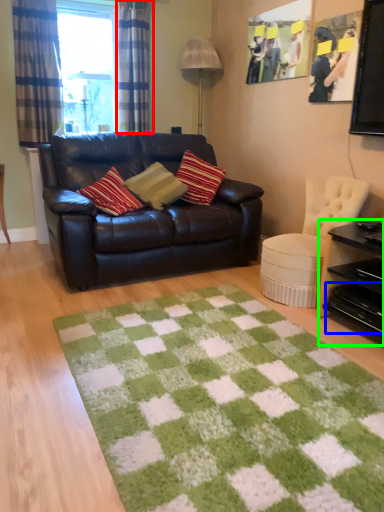
Question: Which is nearer to the curtain (highlighted by a red box)? drawer (highlighted by a blue box) or table (highlighted by a green box).

Choices:
 (A) drawer
 (B) table

Answer: (B)